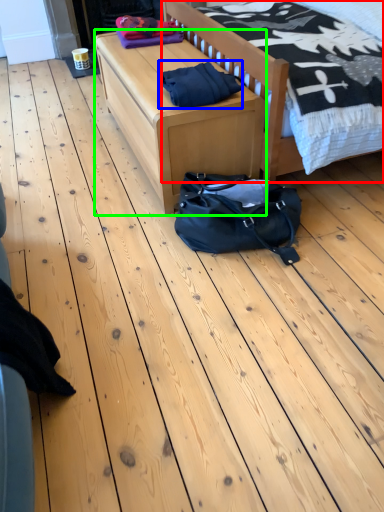
Question: Estimate the real-world distances between objects in this image. Which object is closer to bed (highlighted by a red box), material (highlighted by a blue box) or table (highlighted by a green box)?

Choices:
 (A) material
 (B) table

Answer: (A)